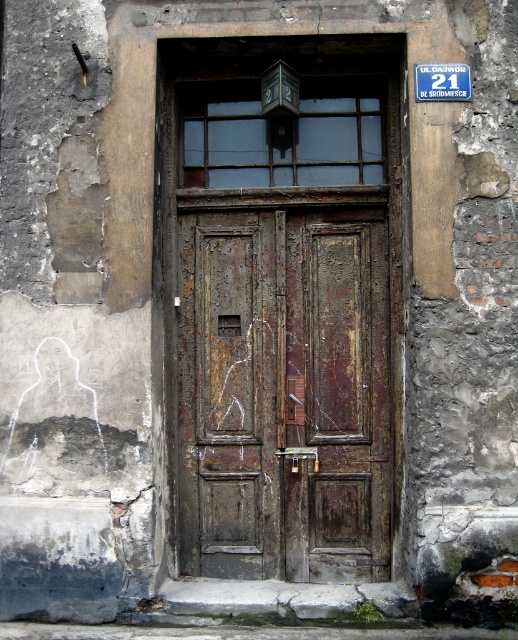
Which is more to the right, rusty wood door at center or blue plastic sign at upper center?

blue plastic sign at upper center

The width and height of the screenshot is (518, 640). What do you see at coordinates (284, 394) in the screenshot?
I see `rusty wood door at center` at bounding box center [284, 394].

This screenshot has height=640, width=518. Identify the location of rusty wood door at center. (284, 394).